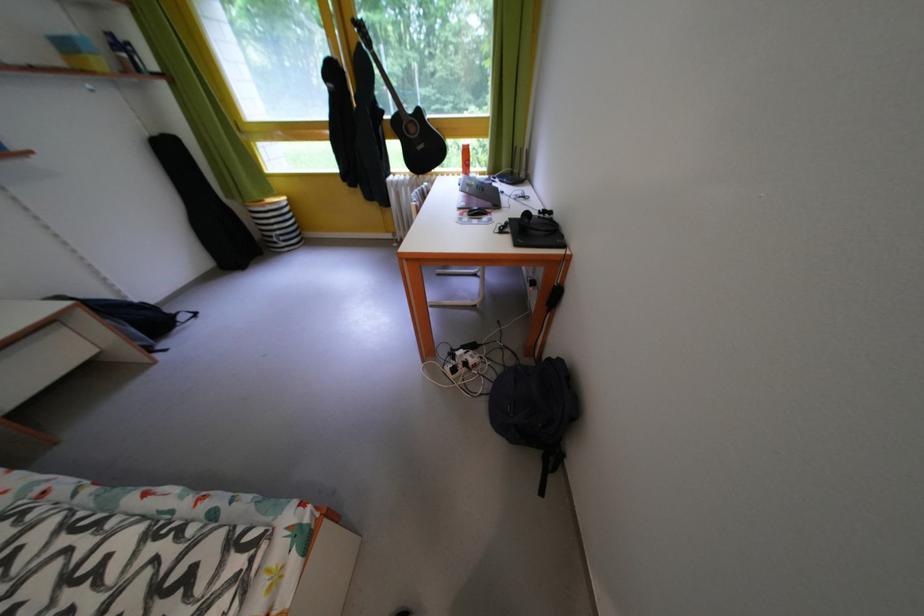
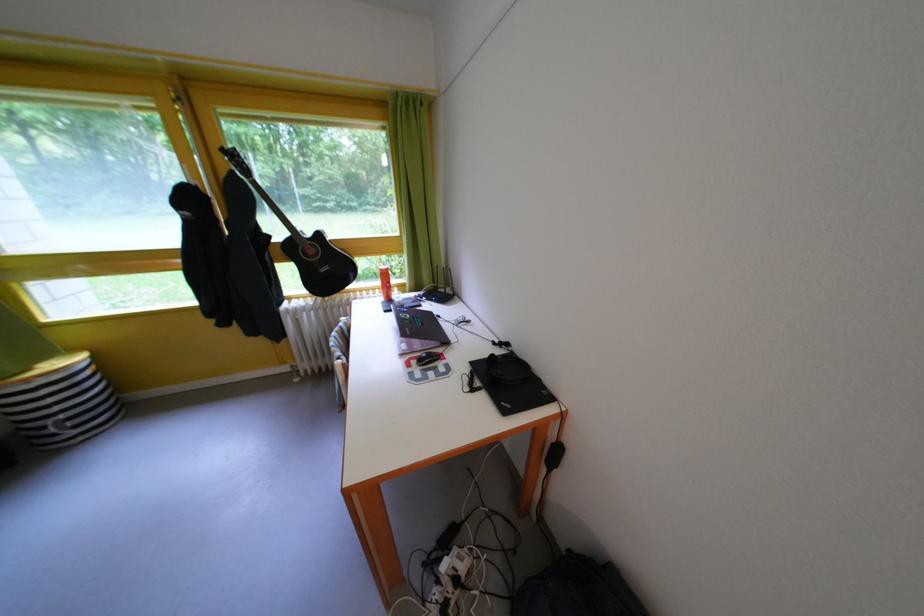
Question: The camera is either moving clockwise (left) or counter-clockwise (right) around the object. The first image is from the beginning of the video and the second image is from the end. Is the camera moving left or right when shooting the video?

Choices:
 (A) Left
 (B) Right

Answer: (A)